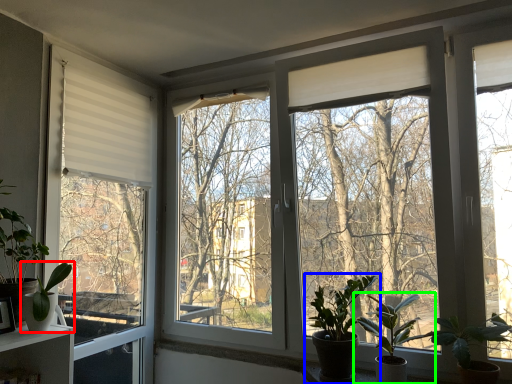
Question: Based on their relative distances, which object is farther from houseplant (highlighted by a red box)? Choose from houseplant (highlighted by a blue box) and houseplant (highlighted by a green box).

Choices:
 (A) houseplant
 (B) houseplant

Answer: (B)